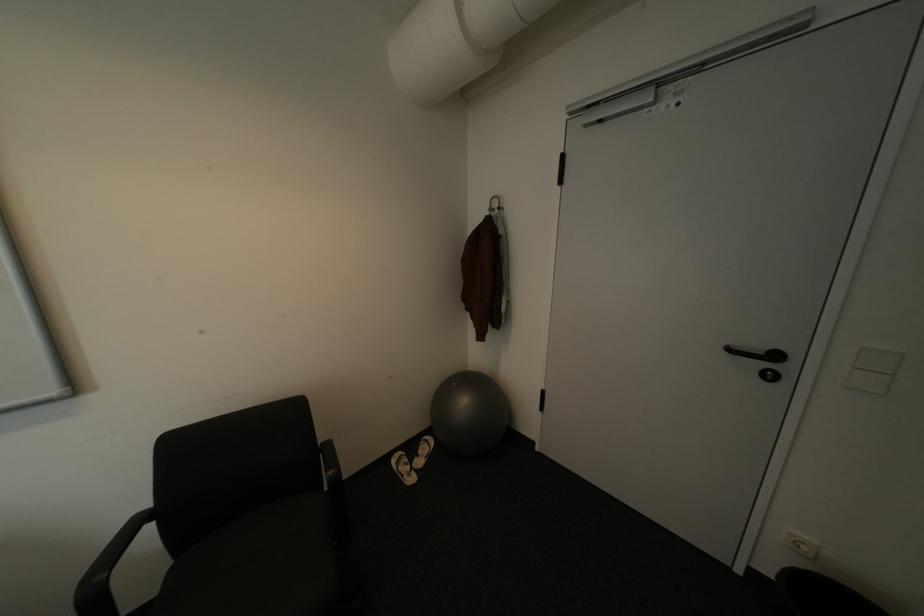
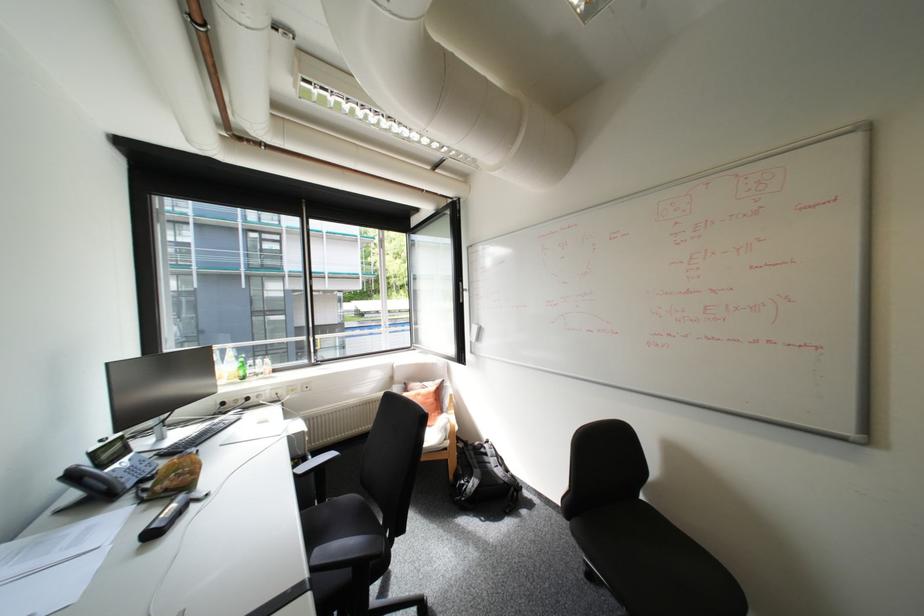
Question: How did the camera likely rotate?

Choices:
 (A) Left
 (B) Right
 (C) Up
 (D) Down

Answer: (A)